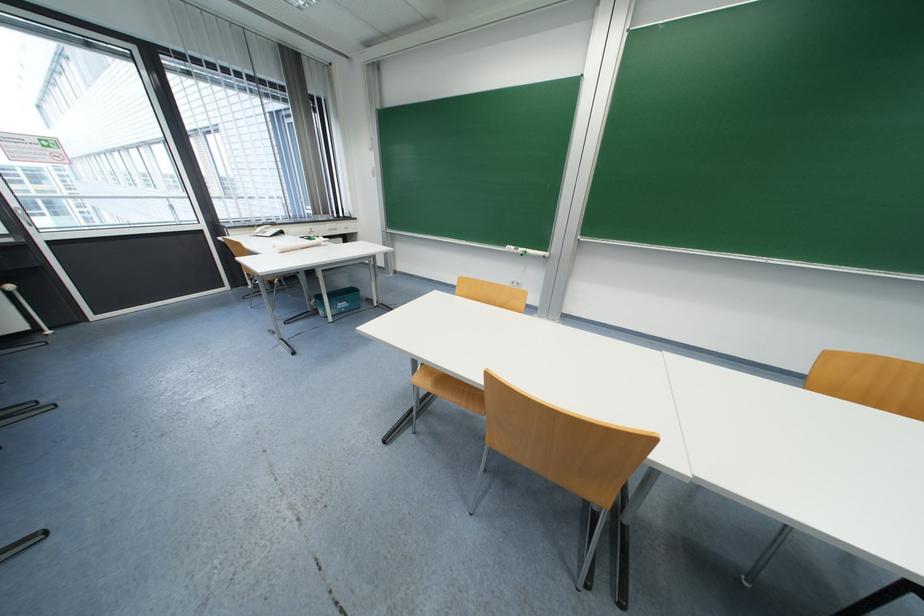
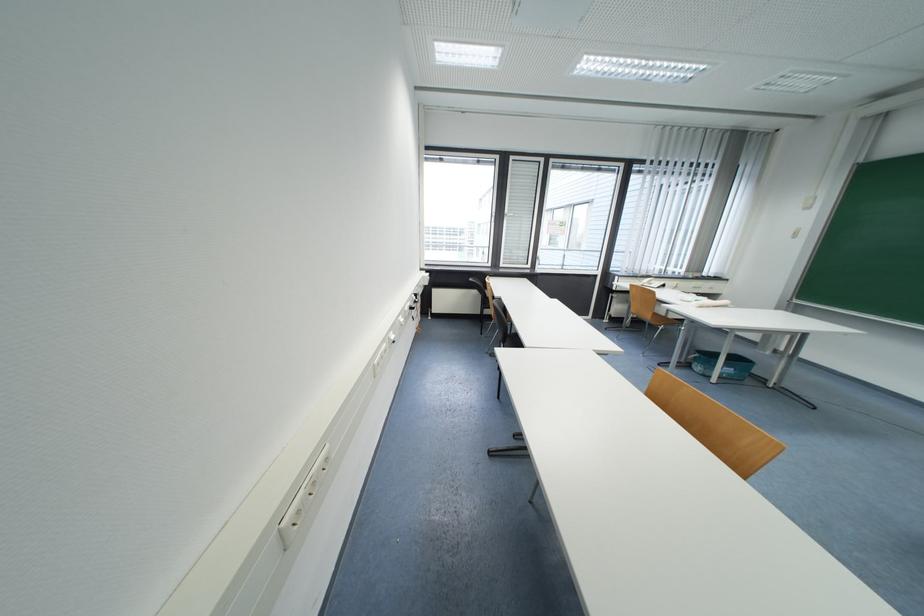
Find the pixel in the second image that matches [350,310] in the first image.

(734, 377)